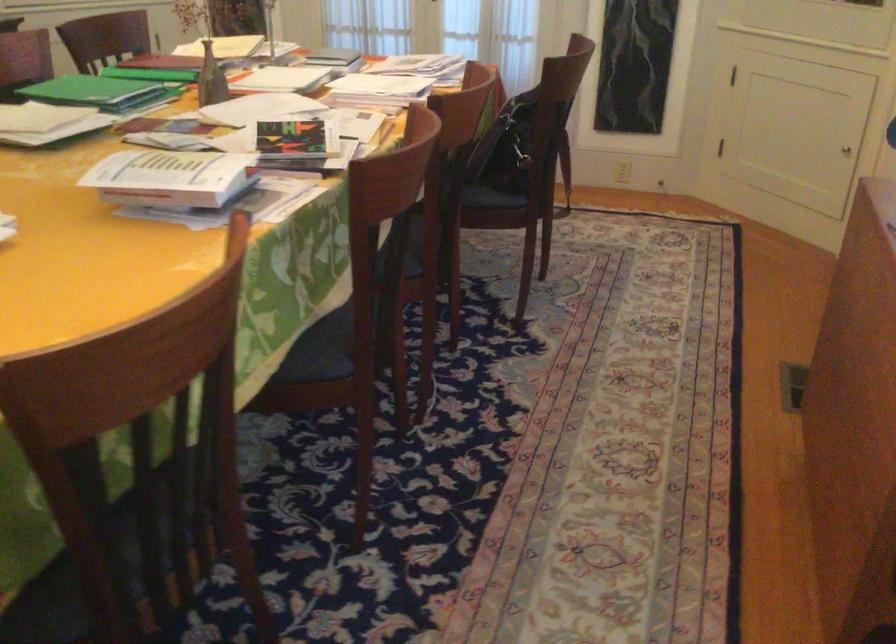
This screenshot has width=896, height=644. What do you see at coordinates (564, 172) in the screenshot? I see `the black bag strap` at bounding box center [564, 172].